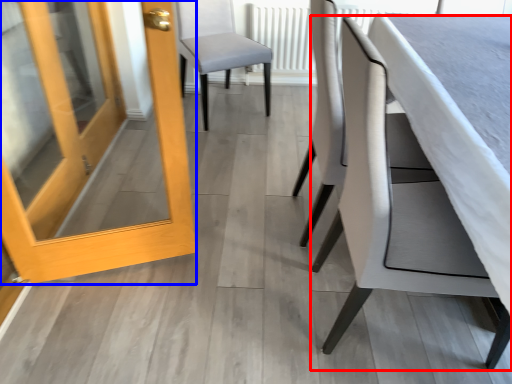
Question: Which object is closer to the camera taking this photo, chair (highlighted by a red box) or door (highlighted by a blue box)?

Choices:
 (A) chair
 (B) door

Answer: (A)